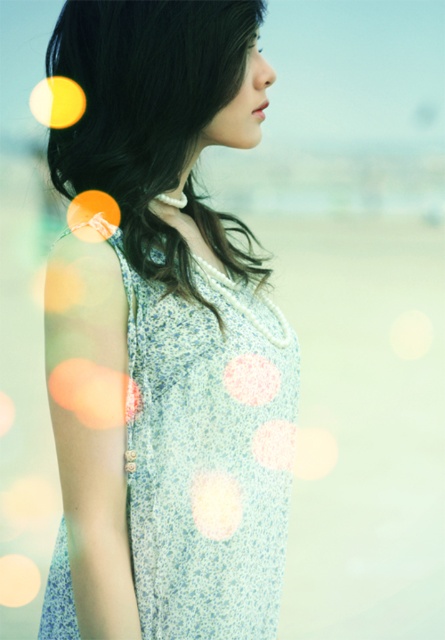
You are a photographer analyzing the image. You notice two points in the scene at coordinates point [193,108] and point [262,381]. Based on the bokeh effect and depth of field, which point is farther from the camera?

Point [193,108] is behind point [262,381], so it is farther from the camera.

Based on the scene description, where is the white textured fabric at center located in terms of coordinates?

The white textured fabric at center is located at coordinates point (215, 502).

You are a photographer adjusting the focus of your camera. The subject is the person in the image wearing a sleeveless dress with a pearl necklace. You notice a pink fabric polka dot at center. Where exactly is the pink fabric polka dot located in terms of coordinates?

The pink fabric polka dot at center is located at point (251, 378).